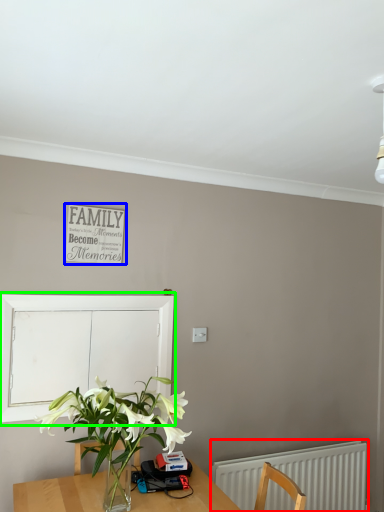
Question: Which is nearer to the radiator (highlighted by a red box)? bulletin board (highlighted by a blue box) or window screen (highlighted by a green box).

Choices:
 (A) bulletin board
 (B) window screen

Answer: (B)